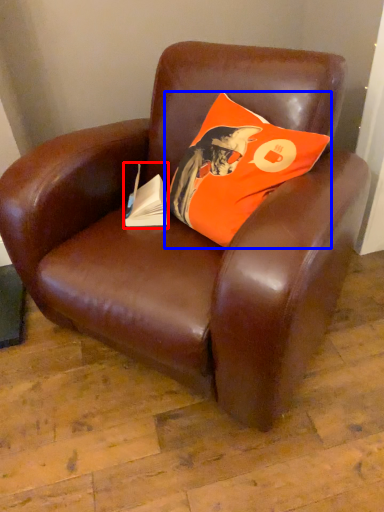
Question: Which object is closer to the camera taking this photo, paperback book (highlighted by a red box) or pillow (highlighted by a blue box)?

Choices:
 (A) paperback book
 (B) pillow

Answer: (B)